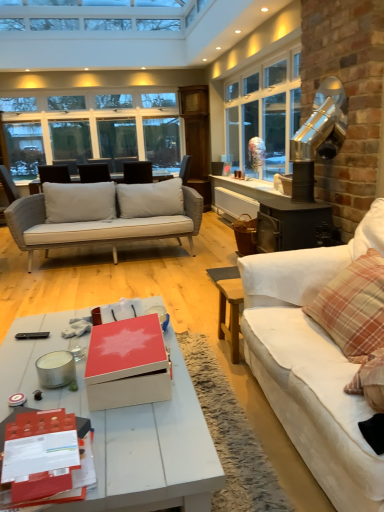
Image resolution: width=384 pixels, height=512 pixels. Find the location of `blank space to the left of matte red box at center`. blank space to the left of matte red box at center is located at coordinates (38, 369).